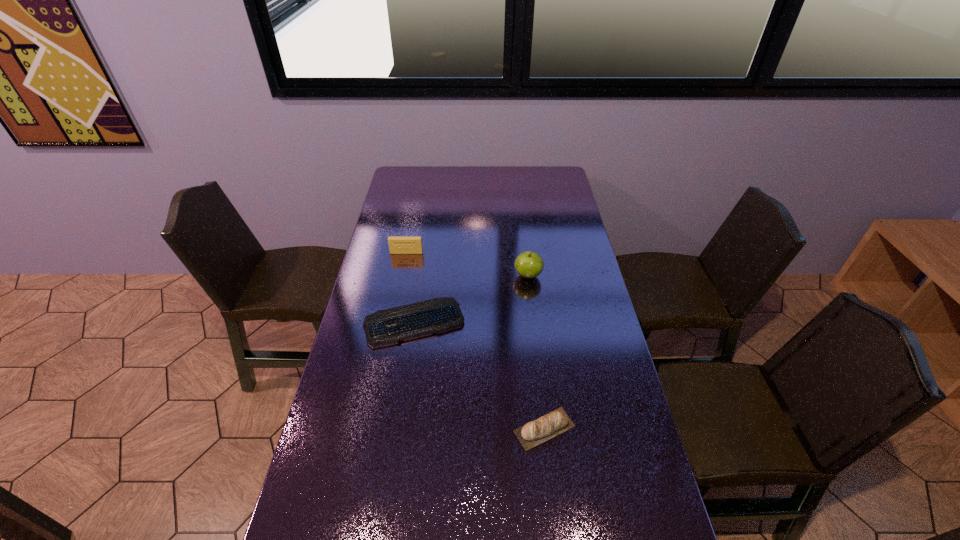
Where is `apple`? apple is located at coordinates (528, 264).

I want to click on the tallest object, so click(528, 264).

Locate an element on the screen. the farthest object is located at coordinates (397, 245).

Identify the location of videotape. (397, 245).

Identify the location of the nearest object. pos(556,422).

Image resolution: width=960 pixels, height=540 pixels. In order to click on the third tallest object in this screenshot , I will do `click(556, 422)`.

You are a GUI agent. You are given a task and a screenshot of the screen. Output one action in this format:
    pyautogui.click(x=<x>, y=<y>)
    Task: Click on the computer keyboard
    This screenshot has height=540, width=960.
    Given the screenshot: What is the action you would take?
    pyautogui.click(x=384, y=327)

Image resolution: width=960 pixels, height=540 pixels. I want to click on the shortest object, so click(384, 327).

Where is `free space located 0.290m on the front of the apple`? free space located 0.290m on the front of the apple is located at coordinates (537, 350).

Find the location of a particular element. free location located 0.320m at the front of the third shortest object with spools is located at coordinates (395, 315).